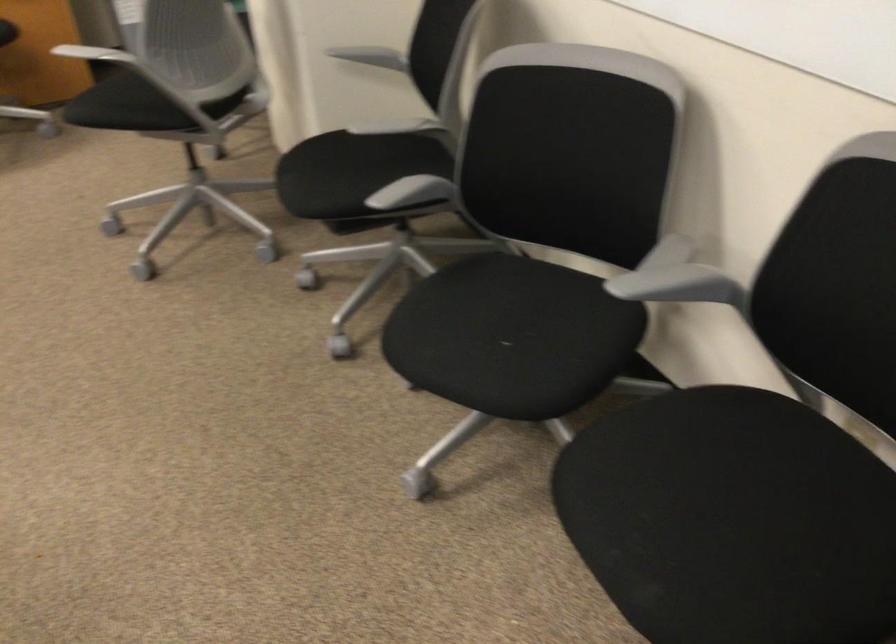
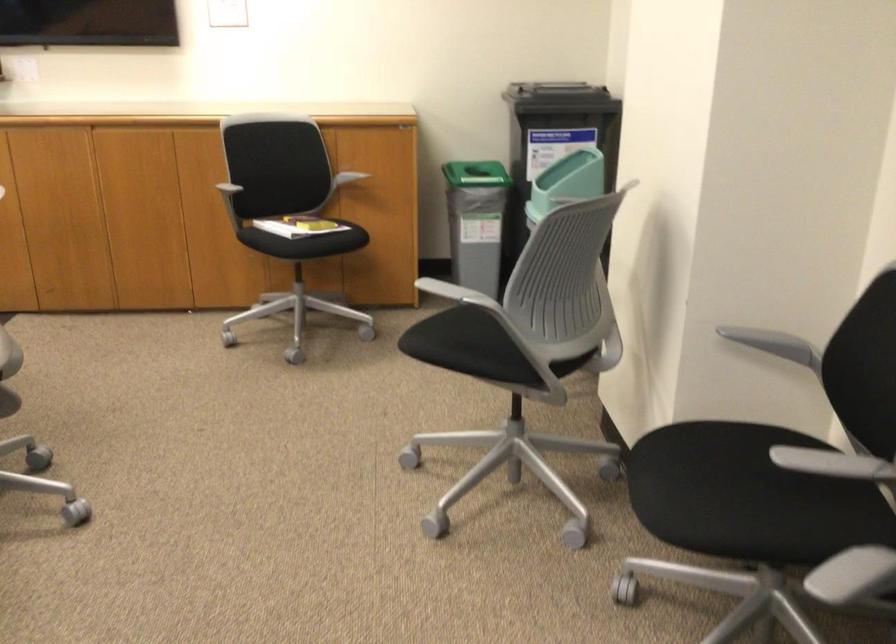
What movement of the cameraman would produce the second image?

The movement direction of the cameraman is left, forward.